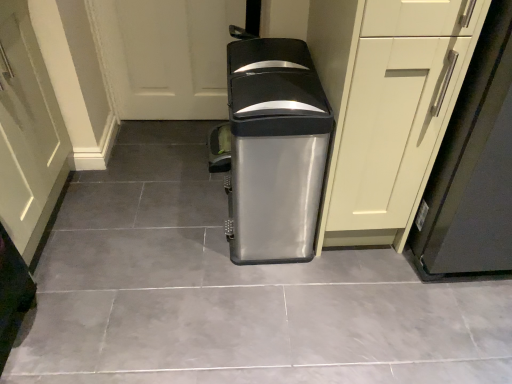
Question: Should I look upward or downward to see satin metallic trash can at center?

Choices:
 (A) down
 (B) up

Answer: (A)

Question: From the image's perspective, would you say satin silver trash can at center is shown under matte white cabinet at right?

Choices:
 (A) no
 (B) yes

Answer: (B)

Question: Is satin silver trash can at center located outside matte white cabinet at right?

Choices:
 (A) yes
 (B) no

Answer: (A)

Question: Can you confirm if satin silver trash can at center is positioned to the left of matte white cabinet at right?

Choices:
 (A) yes
 (B) no

Answer: (A)

Question: Can you confirm if satin silver trash can at center is taller than matte white cabinet at right?

Choices:
 (A) no
 (B) yes

Answer: (A)

Question: Can you confirm if satin silver trash can at center is thinner than matte white cabinet at right?

Choices:
 (A) no
 (B) yes

Answer: (B)

Question: Is satin silver trash can at center at the right side of matte white cabinet at right?

Choices:
 (A) no
 (B) yes

Answer: (A)

Question: Is matte green door at lower left not within matte white cabinet at center?

Choices:
 (A) yes
 (B) no

Answer: (A)

Question: Considering the relative sizes of matte green door at lower left and matte white cabinet at center in the image provided, is matte green door at lower left taller than matte white cabinet at center?

Choices:
 (A) no
 (B) yes

Answer: (A)

Question: Is the surface of matte green door at lower left in direct contact with matte white cabinet at center?

Choices:
 (A) no
 (B) yes

Answer: (A)

Question: Considering the relative positions of matte green door at lower left and matte white cabinet at center in the image provided, is matte green door at lower left to the left of matte white cabinet at center from the viewer's perspective?

Choices:
 (A) yes
 (B) no

Answer: (A)

Question: Is matte green door at lower left at the right side of matte white cabinet at center?

Choices:
 (A) yes
 (B) no

Answer: (B)

Question: From a real-world perspective, is matte green door at lower left physically below matte white cabinet at center?

Choices:
 (A) no
 (B) yes

Answer: (B)

Question: Considering the relative positions of matte white cabinet at center and matte green door at lower left in the image provided, is matte white cabinet at center to the right of matte green door at lower left from the viewer's perspective?

Choices:
 (A) no
 (B) yes

Answer: (B)